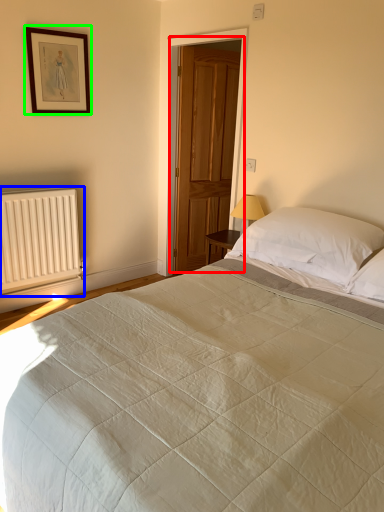
Question: Based on their relative distances, which object is nearer to door (highlighted by a red box)? Choose from radiator (highlighted by a blue box) and picture frame (highlighted by a green box).

Choices:
 (A) radiator
 (B) picture frame

Answer: (B)